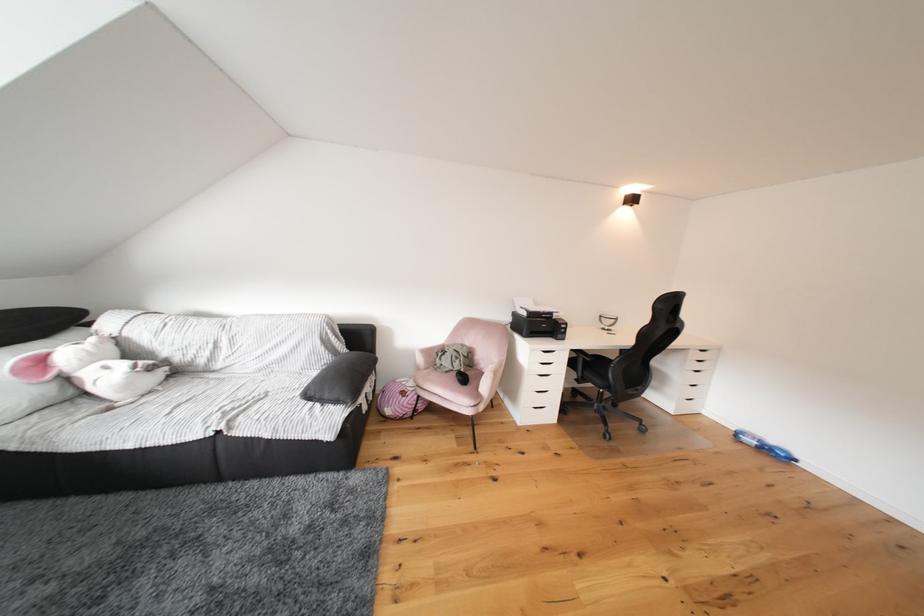
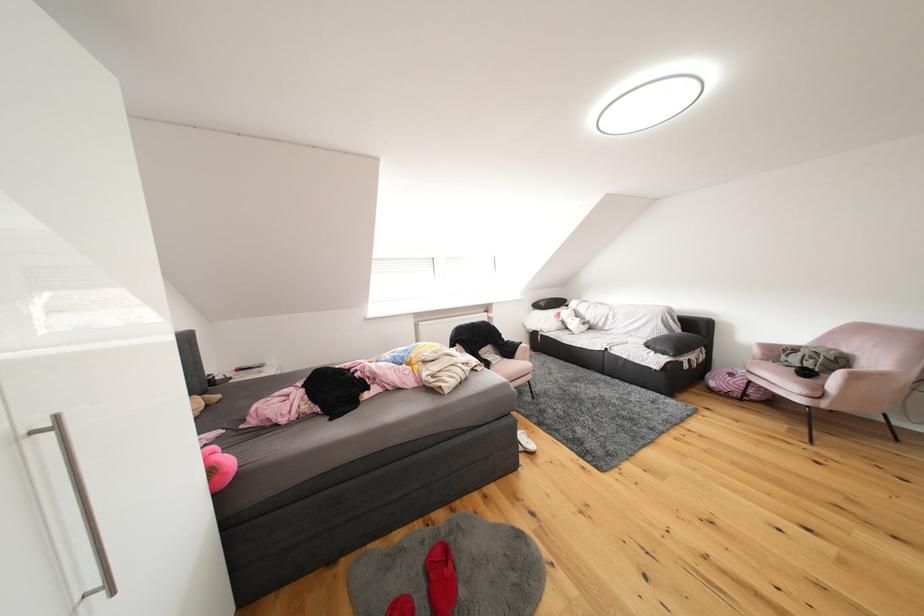
Where in the second image is the point corresponding to point (468, 407) from the first image?

(797, 392)